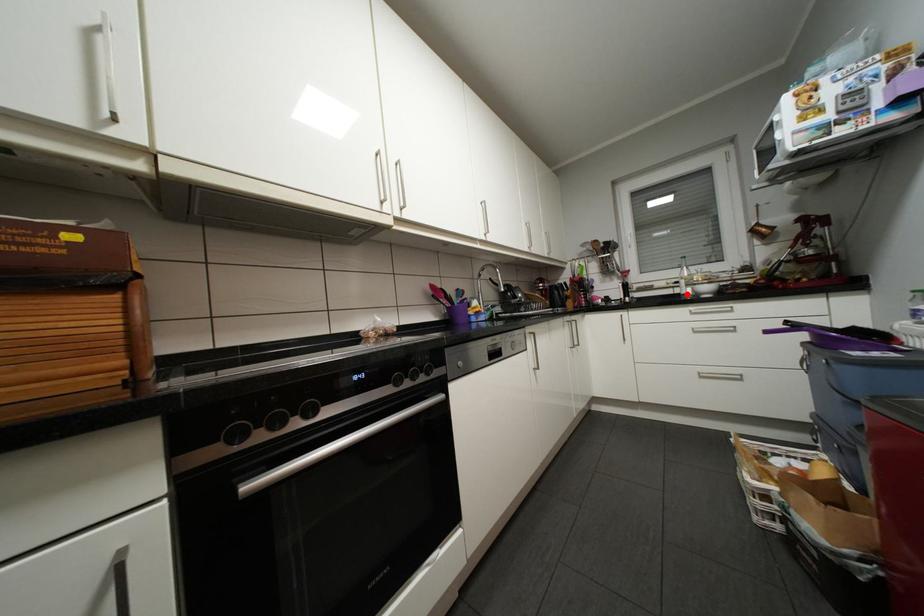
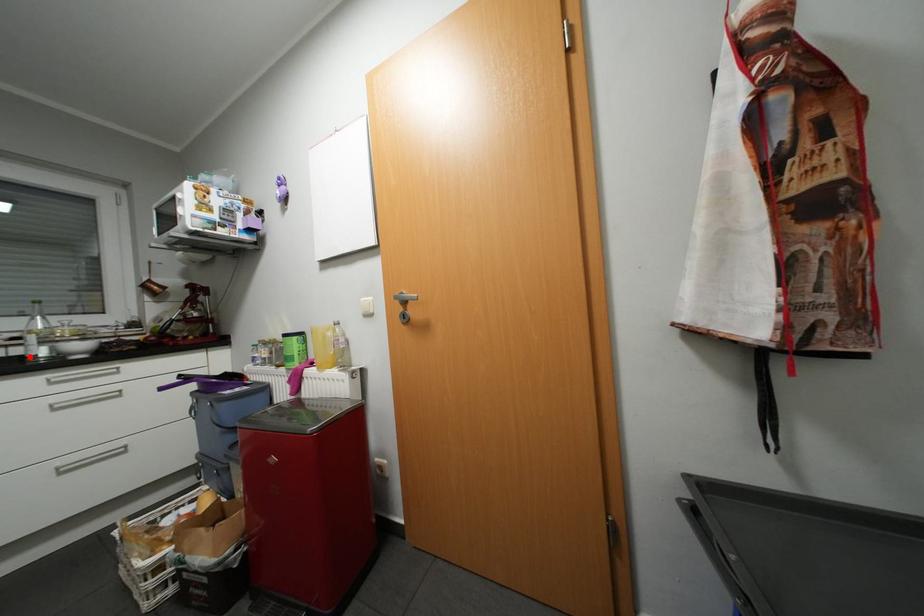
I am providing you with two images of the same scene from different viewpoints. A red point is marked on the first image and another point is marked on the second image. Is the red point in image1 aligned with the point shown in image2?

Yes